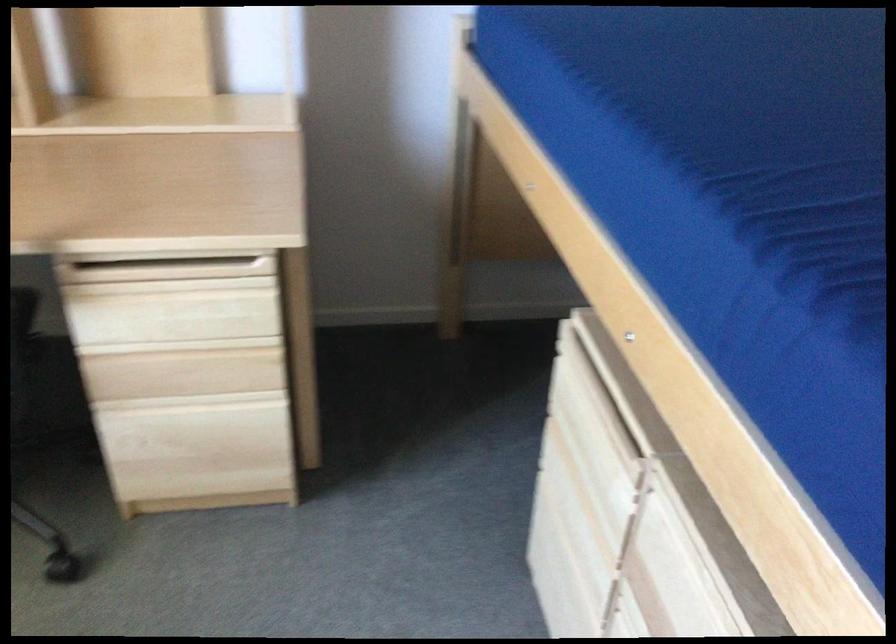
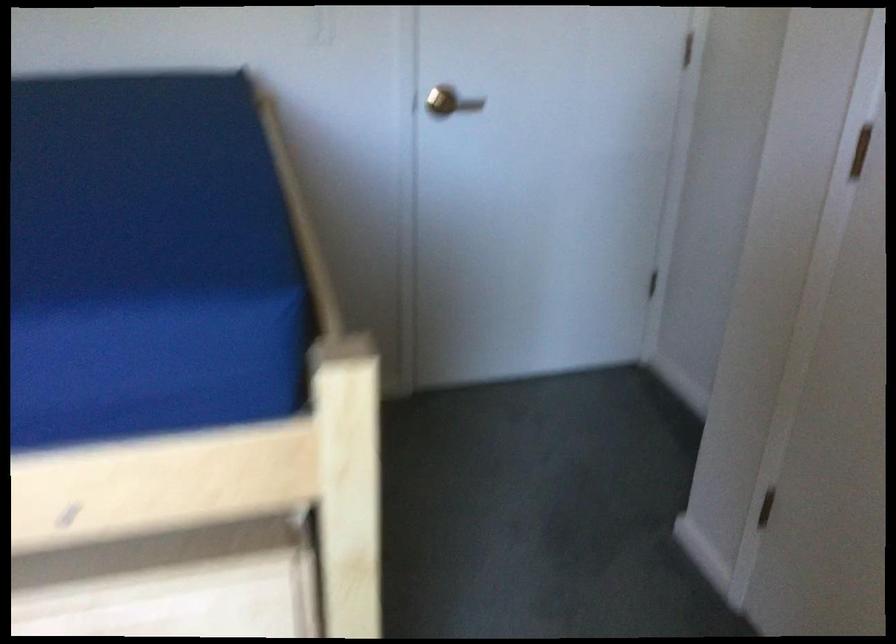
The first image is from the beginning of the video and the second image is from the end. How did the camera likely rotate when shooting the video?

The camera's rotation is toward right-down.